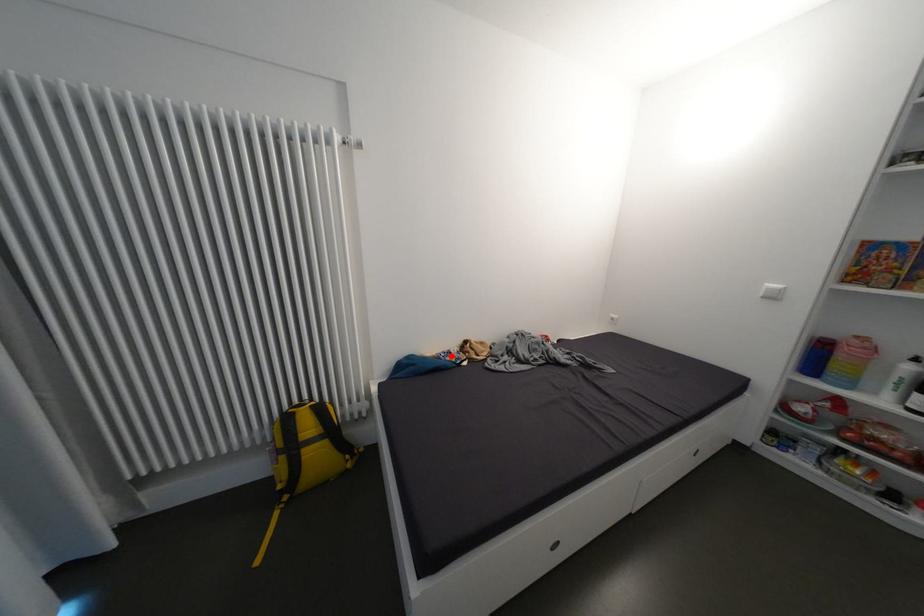
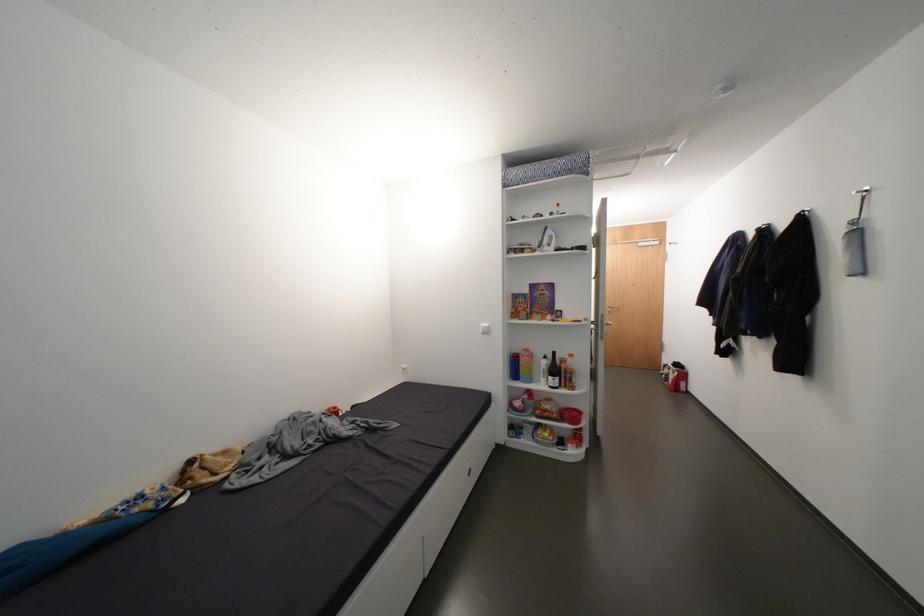
The point at the highlighted location is marked in the first image. Where is the corresponding point in the second image?

(131, 508)